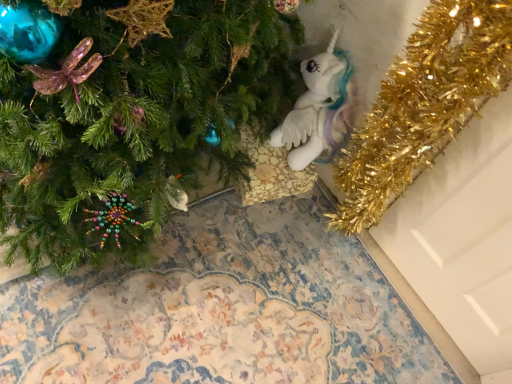
Identify the location of free spot above green matte christmas tree at lower left (from a real-world perspective). (157, 300).